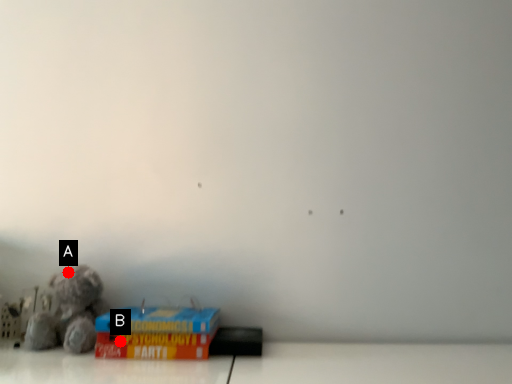
Question: Two points are circled on the image, labeled by A and B beside each circle. Which point is farther to the camera?

Choices:
 (A) A is further
 (B) B is further

Answer: (A)